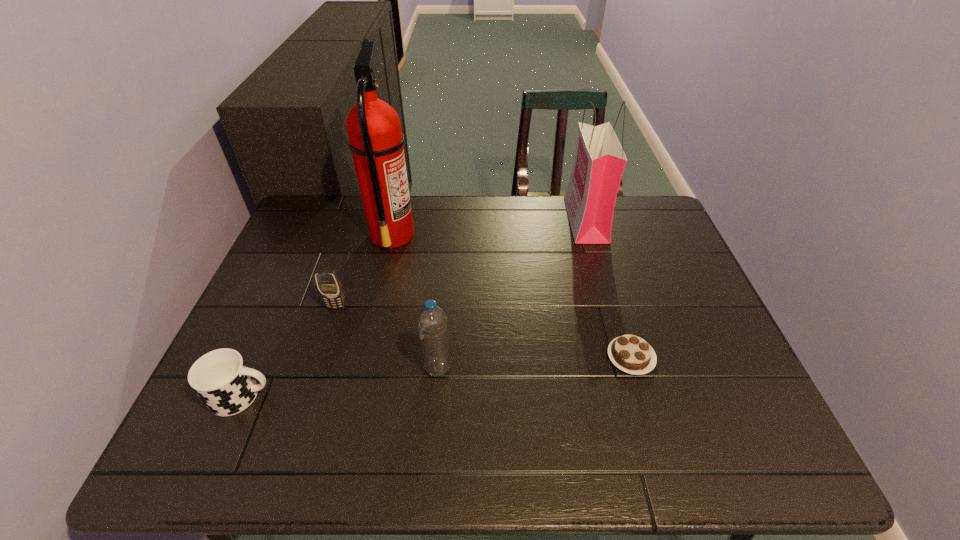
This screenshot has height=540, width=960. Find the location of `vacant space in between the water bottle and the second tallest object`. vacant space in between the water bottle and the second tallest object is located at coordinates (512, 294).

I want to click on empty space that is in between the shortest object and the fire extinguisher, so click(512, 295).

Locate an element on the screen. This screenshot has width=960, height=540. empty space between the water bottle and the shortest object is located at coordinates (535, 363).

You are a GUI agent. You are given a task and a screenshot of the screen. Output one action in this format:
    pyautogui.click(x=<x>, y=<y>)
    Task: Click on the unoccupied area between the shopping bag and the cup
    This screenshot has height=540, width=960.
    Given the screenshot: What is the action you would take?
    pyautogui.click(x=414, y=308)

Where is `free area in between the third object from right to left and the cup`? free area in between the third object from right to left and the cup is located at coordinates (340, 382).

Find the location of a particular element. This screenshot has width=960, height=540. vacant region between the shopping bag and the fifth object from right to left is located at coordinates (461, 263).

Locate an element on the screen. This screenshot has width=960, height=540. blank region between the cellular telephone and the chocolate cake is located at coordinates [x=484, y=332].

Locate an element on the screen. the third closest object to the fifth shortest object is located at coordinates (432, 322).

Point out which object is positioned as the second nearest to the fifth tallest object. Please provide its 2D coordinates. Your answer should be formatted as a tuple, i.e. [(x, y)], where the tuple contains the x and y coordinates of a point satisfying the conditions above.

[(432, 322)]

Locate an element on the screen. Image resolution: width=960 pixels, height=540 pixels. vacant area in the image that satisfies the following two spatial constraints: 1. on the back side of the third tallest object; 2. on the side of the tallest object near the handle is located at coordinates (448, 234).